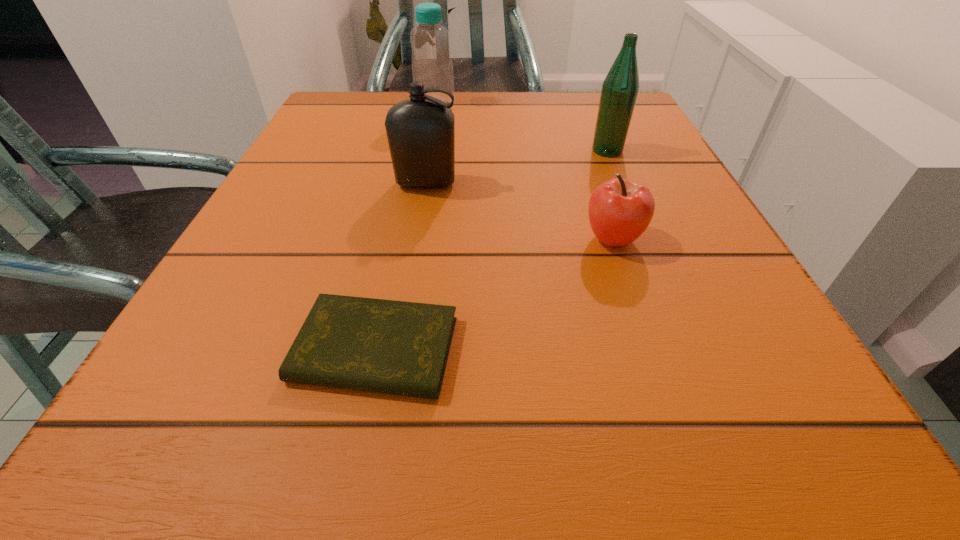
You are a GUI agent. You are given a task and a screenshot of the screen. Output one action in this format:
    pyautogui.click(x=<x>, y=<y>)
    Task: Click on the blank region between the nearest object and the second farthest bottle
    Image resolution: width=960 pixels, height=540 pixels.
    Given the screenshot: What is the action you would take?
    pyautogui.click(x=492, y=250)

Identify the location of free space that is in between the nearest object and the second farthest bottle. The height and width of the screenshot is (540, 960). (492, 250).

Locate an element on the screen. The width and height of the screenshot is (960, 540). free space between the third farthest object and the fourth tallest object is located at coordinates (519, 212).

The height and width of the screenshot is (540, 960). Find the location of `vacant point located between the shortest object and the farthest bottle`. vacant point located between the shortest object and the farthest bottle is located at coordinates (405, 227).

Locate an element on the screen. empty space that is in between the shortest object and the second farthest object is located at coordinates [x=492, y=250].

Find the location of a particular element. free point between the diary and the farthest bottle is located at coordinates tap(405, 227).

The image size is (960, 540). Identify the location of vacant space that is in between the second farthest bottle and the nearest object. (492, 250).

Identify which object is the fourth nearest to the farthest bottle. Please provide its 2D coordinates. Your answer should be formatted as a tuple, i.e. [(x, y)], where the tuple contains the x and y coordinates of a point satisfying the conditions above.

[(395, 347)]

Identify the location of object that is the closest to the rightmost bottle. (620, 210).

You are a GUI agent. You are given a task and a screenshot of the screen. Output one action in this format:
    pyautogui.click(x=<x>, y=<y>)
    Task: Click on the bottle that is the second closest to the farthest bottle
    The width and height of the screenshot is (960, 540).
    Given the screenshot: What is the action you would take?
    pyautogui.click(x=620, y=88)